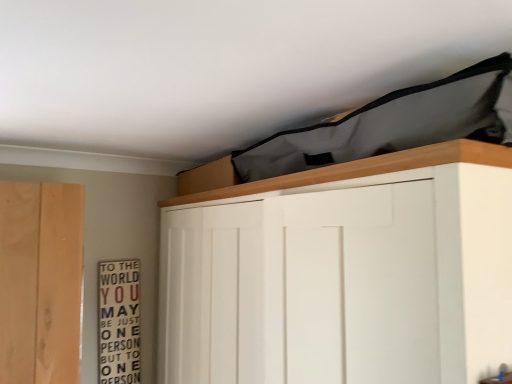
Question: Is wooden signboard at left situated inside white matte cupboard at upper center or outside?

Choices:
 (A) outside
 (B) inside

Answer: (A)

Question: Is wooden signboard at left taller or shorter than white matte cupboard at upper center?

Choices:
 (A) tall
 (B) short

Answer: (B)

Question: From a real-world perspective, relative to white matte cupboard at upper center, is wooden signboard at left vertically above or below?

Choices:
 (A) below
 (B) above

Answer: (A)

Question: In the image, is white matte cupboard at upper center positioned in front of or behind wooden signboard at left?

Choices:
 (A) behind
 (B) front

Answer: (B)

Question: Based on their positions, is white matte cupboard at upper center located to the left or right of wooden signboard at left?

Choices:
 (A) left
 (B) right

Answer: (B)

Question: Considering the positions of white matte cupboard at upper center and wooden signboard at left in the image, is white matte cupboard at upper center bigger or smaller than wooden signboard at left?

Choices:
 (A) small
 (B) big

Answer: (B)

Question: In terms of width, does white matte cupboard at upper center look wider or thinner when compared to wooden signboard at left?

Choices:
 (A) wide
 (B) thin

Answer: (A)